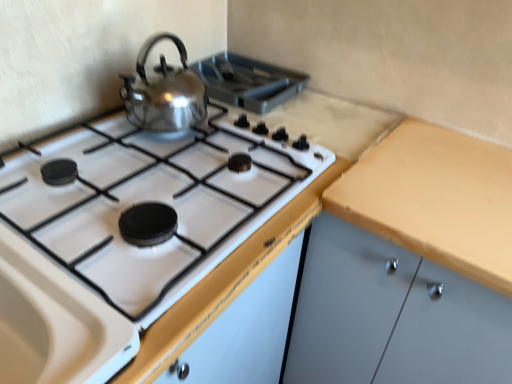
Locate an element on the screen. This screenshot has height=384, width=512. free space underneath shiny metallic kettle at upper left (from a real-world perspective) is located at coordinates (168, 133).